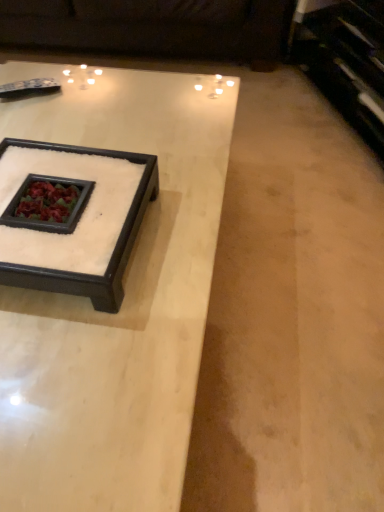
Where is `vacant space to the right of white marble tray at center, acting as the second coffee table starting from the front`? The width and height of the screenshot is (384, 512). vacant space to the right of white marble tray at center, acting as the second coffee table starting from the front is located at coordinates (180, 232).